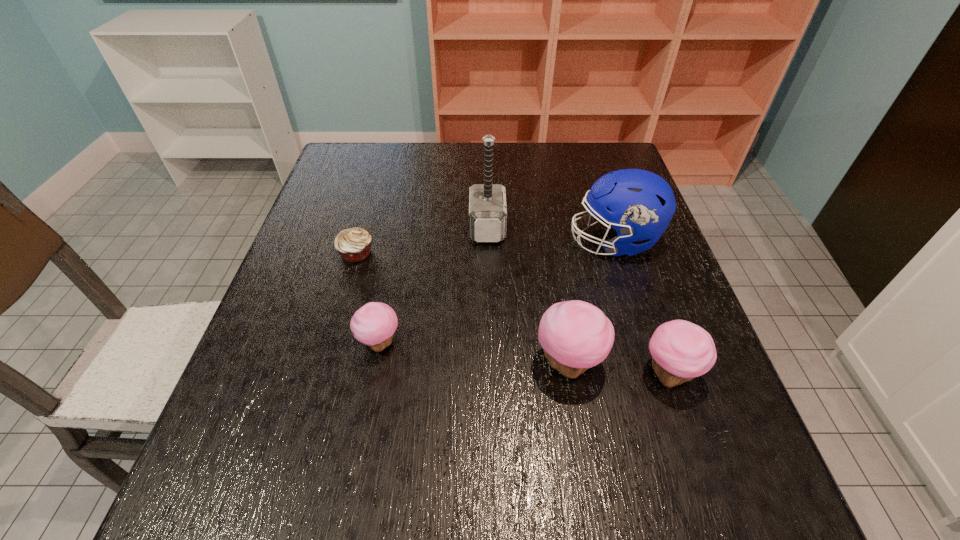
You are a GUI agent. You are given a task and a screenshot of the screen. Output one action in this format:
    pyautogui.click(x=<x>, y=<y>)
    Task: Click on the vacant region located on the front-facing side of the fifth shortest object
    
    Given the screenshot: What is the action you would take?
    pyautogui.click(x=418, y=241)

This screenshot has width=960, height=540. I want to click on object that is positioned at the left edge, so coord(354,244).

Where is `cupcake present at the right edge`? The image size is (960, 540). cupcake present at the right edge is located at coordinates (680, 350).

Where is `football helmet that is at the right edge`? The image size is (960, 540). football helmet that is at the right edge is located at coordinates [639, 204].

The image size is (960, 540). Identify the location of vacant region at the near edge. (414, 420).

Where is `blank space at the left edge`? This screenshot has width=960, height=540. blank space at the left edge is located at coordinates (261, 330).

Where is `free space at the right edge of the desktop`? This screenshot has height=540, width=960. free space at the right edge of the desktop is located at coordinates (658, 392).

The image size is (960, 540). Identify the location of vacant region at the far left corner of the desktop. pyautogui.click(x=352, y=142).

Locate an element on the screen. free space between the second shortest cupcake and the shortest cupcake is located at coordinates (524, 359).

Find the location of a particular element. vacant point located between the fifth shortest object and the second cupcake from left to right is located at coordinates (591, 302).